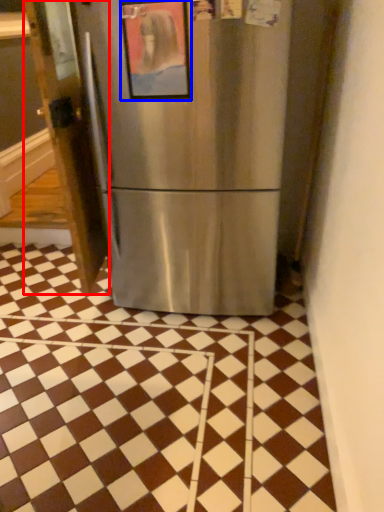
Question: Which point is closer to the camera, door (highlighted by a red box) or picture frame (highlighted by a blue box)?

Choices:
 (A) door
 (B) picture frame

Answer: (B)